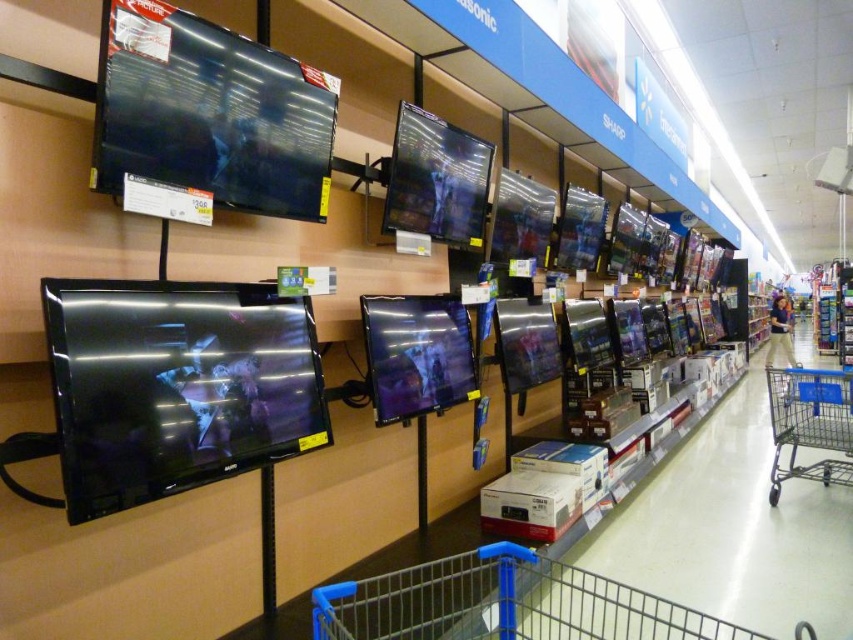
Question: Can you confirm if metallic gray shopping cart at lower right is bigger than beige cotton pants at lower right?

Choices:
 (A) no
 (B) yes

Answer: (B)

Question: Which object is positioned farthest from the blue metal shopping cart at lower center?

Choices:
 (A) metallic gray shopping cart at lower right
 (B) beige cotton pants at lower right

Answer: (B)

Question: Which object appears closest to the camera in this image?

Choices:
 (A) metallic gray shopping cart at lower right
 (B) blue metal shopping cart at lower center

Answer: (B)

Question: Is blue metal shopping cart at lower center to the right of beige cotton pants at lower right from the viewer's perspective?

Choices:
 (A) yes
 (B) no

Answer: (B)

Question: Estimate the real-world distances between objects in this image. Which object is farther from the blue metal shopping cart at lower center?

Choices:
 (A) metallic gray shopping cart at lower right
 (B) beige cotton pants at lower right

Answer: (B)

Question: Does blue metal shopping cart at lower center have a larger size compared to metallic gray shopping cart at lower right?

Choices:
 (A) yes
 (B) no

Answer: (A)